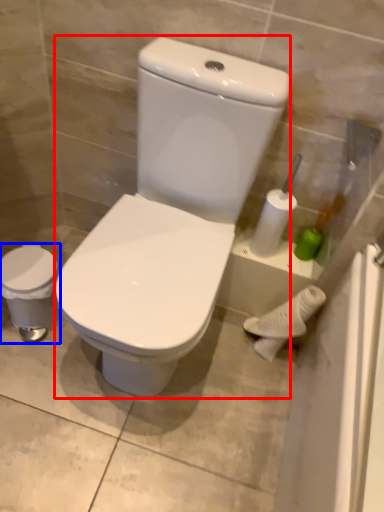
Question: Among these objects, which one is nearest to the camera, porcelain (highlighted by a red box) or porcelain (highlighted by a blue box)?

Choices:
 (A) porcelain
 (B) porcelain

Answer: (A)